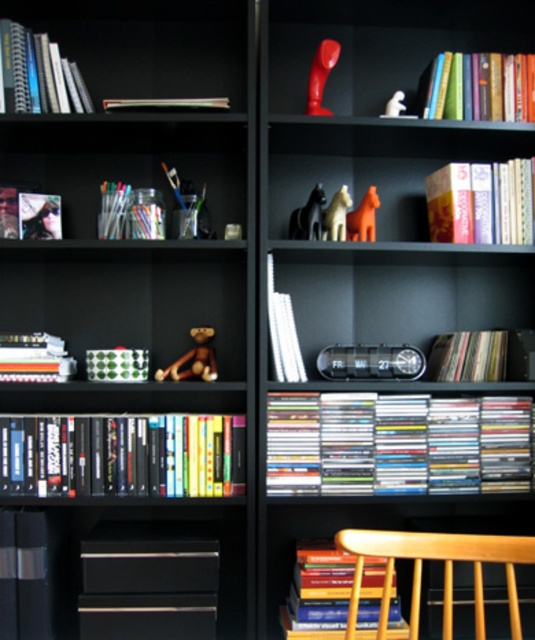
Question: Does black matte horse at upper center appear on the left side of matte orange horse at upper right?

Choices:
 (A) yes
 (B) no

Answer: (A)

Question: Estimate the real-world distances between objects in this image. Which object is closer to the hardcover books at upper left?

Choices:
 (A) black matte horse at upper center
 (B) matte black photo frame at upper left

Answer: (B)

Question: Does matte plastic cds at center have a smaller size compared to hardcover books at upper left?

Choices:
 (A) yes
 (B) no

Answer: (B)

Question: Can you confirm if hardcover books at center is positioned to the right of translucent plastic jar at upper left?

Choices:
 (A) no
 (B) yes

Answer: (B)

Question: Based on their relative distances, which object is farther from the hardcover book at lower center?

Choices:
 (A) rubber-like red toy at upper center
 (B) black matte horse at upper center
 (C) metallic gold horse at upper center
 (D) matte black photo frame at upper left

Answer: (A)

Question: Among these objects, which one is nearest to the camera?

Choices:
 (A) black matte horse at upper center
 (B) striped paper book at lower left
 (C) matte red phone at upper center

Answer: (B)